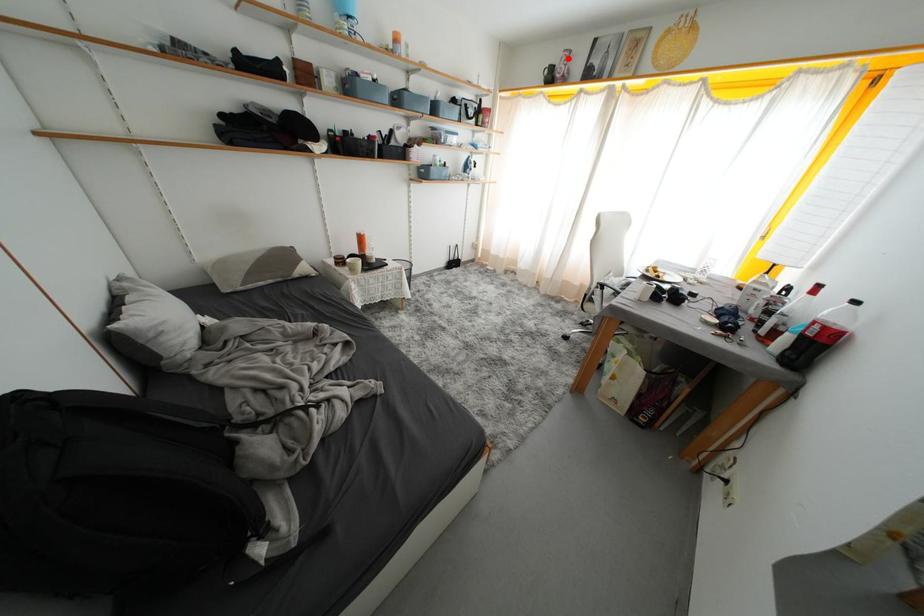
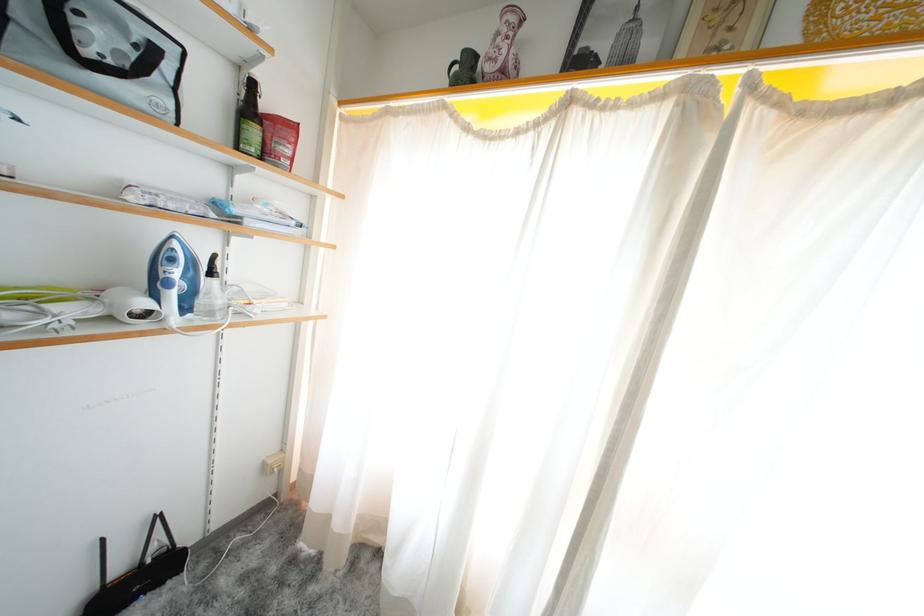
The point at the highlighted location is marked in the first image. Where is the corresponding point in the second image?

(504, 28)